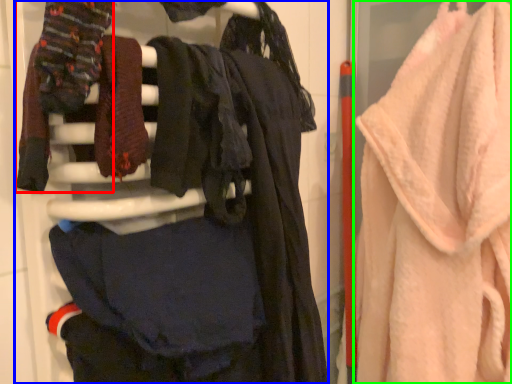
Question: Which is farther away from clothing (highlighted by a red box)? closet (highlighted by a blue box) or towel (highlighted by a green box)?

Choices:
 (A) closet
 (B) towel

Answer: (B)